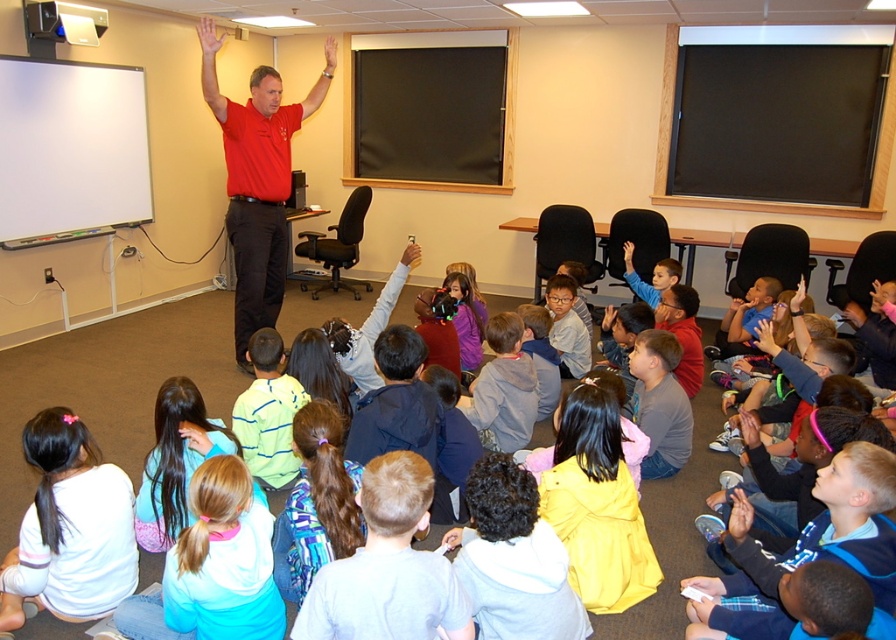
You are a teacher in the classroom and want to check the clothing of the students sitting at the lower left corner. Which clothing item is positioned lower between the white matte shirt at lower left and the light blue fleece jacket at lower left?

The white matte shirt at lower left is positioned below the light blue fleece jacket at lower left, so it is the lower one.

Based on the photo, you are a teacher in the classroom and want to hand out a worksheet to the student wearing the light blue fleece jacket at lower left and the student wearing the gray hoodie at center. Which student should you approach first if you want to give the worksheet to the one closer to the front of the classroom?

The light blue fleece jacket at lower left is positioned on the left side of gray hoodie at center, but the description does not provide information about their distance from the front of the classroom. Therefore, it is unclear which student is closer to the front.

You are a student in the classroom and want to borrow a jacket from the light blue fleece jacket at lower left and the gray hoodie at center. Which jacket is bigger and can you wear both at the same time?

The light blue fleece jacket at lower left is larger in size than the gray hoodie at center. However, you cannot wear both at the same time as they are separate garments meant for individual use.